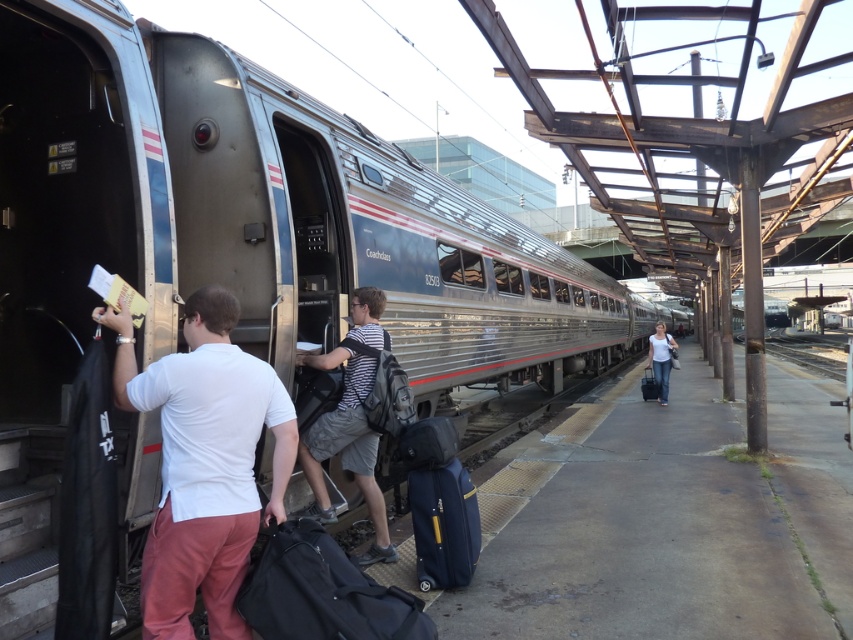
You are a passenger at the train station and you have two suitcases, the blue fabric suitcase at lower center and the matte black suitcase at right. You want to store them in the overhead compartment which has a width of 50 cm. Can you determine if both suitcases will fit side by side?

The blue fabric suitcase at lower center might be wider than matte black suitcase at right. Since the overhead compartment is 50 cm wide, it is uncertain if both suitcases will fit side by side without exceeding the width.

You are standing on the platform of the train station and see the black fabric duffel bag at lower center. Where exactly is it positioned in relation to the train and the passengers?

The black fabric duffel bag at lower center is located at point coordinates (322, 593), which places it near the lower central area of the scene, likely close to the train doors where passengers are boarding or disembarking.